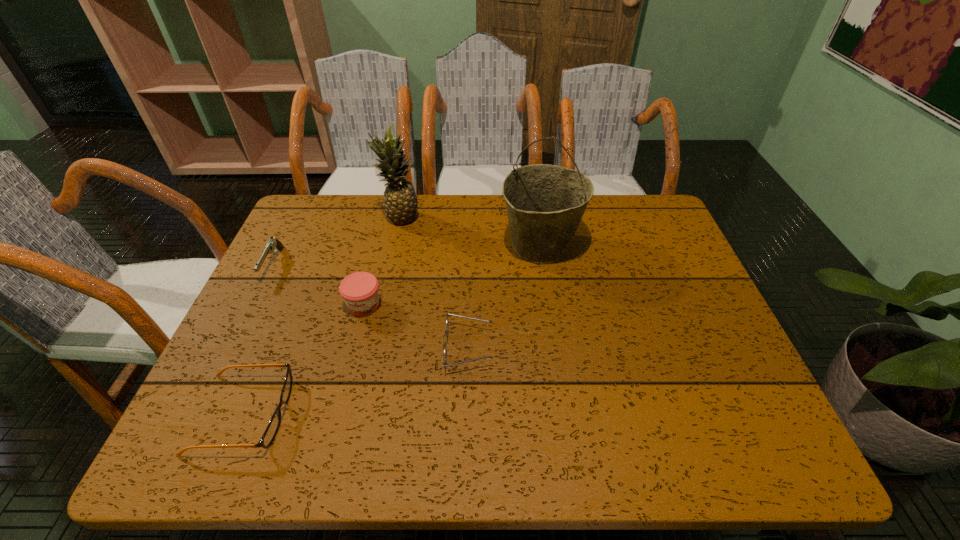
The width and height of the screenshot is (960, 540). I want to click on free location at the near edge, so click(x=331, y=453).

The height and width of the screenshot is (540, 960). In the image, there is a desktop. What are the coordinates of `free space at the left edge` in the screenshot? It's located at (295, 272).

Find the location of `free space at the right edge of the desktop`. free space at the right edge of the desktop is located at coordinates [671, 249].

In the image, there is a desktop. At what (x,y) coordinates should I click in order to perform the action: click on vacant region at the far right corner. Please return your answer as a coordinate pair (x, y). This screenshot has height=540, width=960. Looking at the image, I should click on (625, 230).

Where is `vacant area that lies between the pistol and the jam`? The image size is (960, 540). vacant area that lies between the pistol and the jam is located at coordinates (319, 285).

Locate an element on the screen. vacant point located between the pistol and the pineapple is located at coordinates (337, 241).

Where is `vacant area that lies between the right spectacles and the third tallest object`? Image resolution: width=960 pixels, height=540 pixels. vacant area that lies between the right spectacles and the third tallest object is located at coordinates [x=416, y=327].

Locate an element on the screen. The height and width of the screenshot is (540, 960). free spot between the left spectacles and the pistol is located at coordinates (258, 339).

This screenshot has width=960, height=540. I want to click on free point between the jam and the fifth shortest object, so click(382, 262).

Locate an element on the screen. This screenshot has width=960, height=540. vacant space that is in between the pistol and the jam is located at coordinates (319, 285).